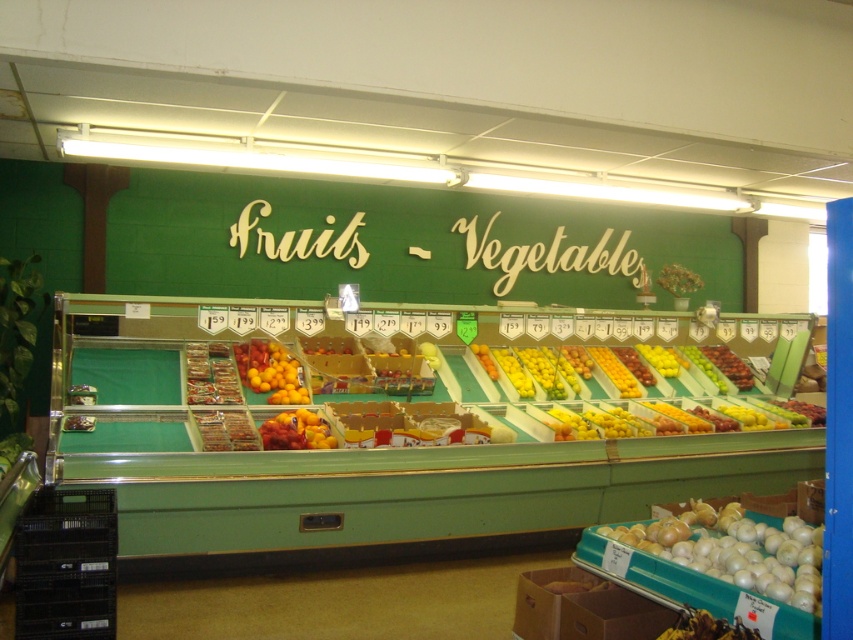
You are a grocery store employee who needs to restock the display case. You have a new shipment of onions and citrus fruits. Based on the current arrangement, where should you place the new white glossy onion at lower right and shiny yellow citrus at center?

The white glossy onion at lower right should be placed below the shiny yellow citrus at center as per the existing arrangement.

Consider the image. You are a grocery store employee who needs to place a new price tag between the white glossy onion at lower right and the shiny red grapes at center. The price tag is 1 meter long. Is there enough space between them to place the price tag horizontally?

The distance between the white glossy onion at lower right and the shiny red grapes at center is 4.17 meters, so there is enough space to place the 1 meter long price tag horizontally between them.